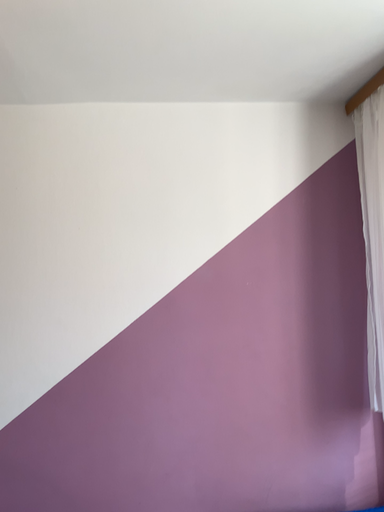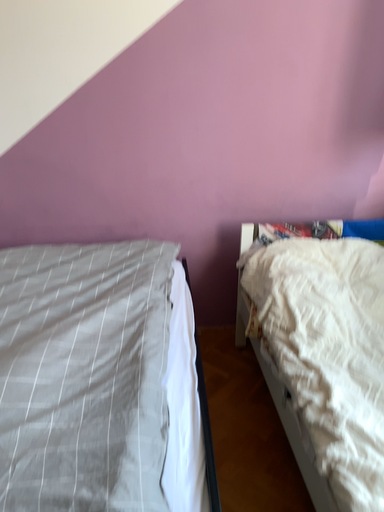
Question: Which way did the camera rotate in the video?

Choices:
 (A) rotated upward
 (B) rotated downward

Answer: (B)